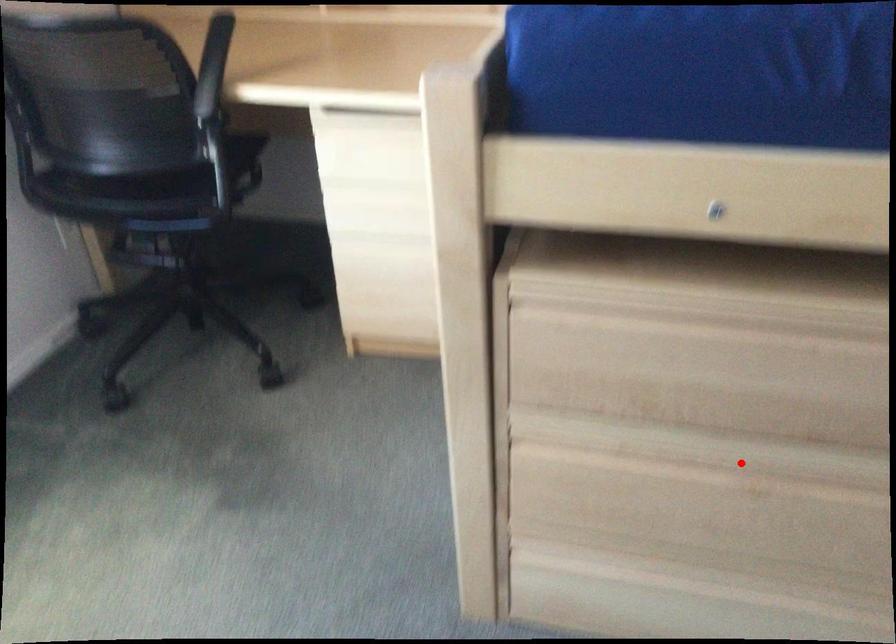
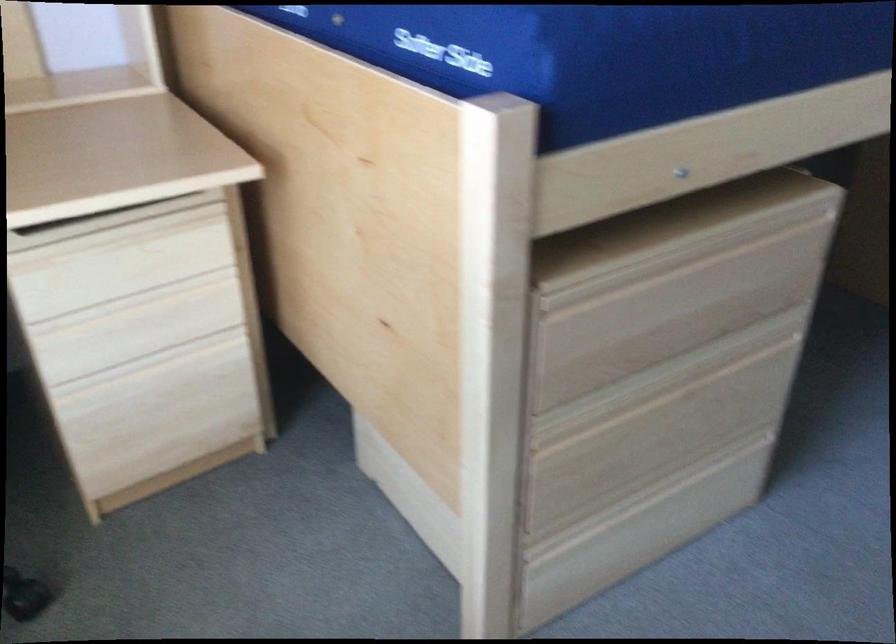
Question: I am providing you with two images of the same scene from different viewpoints. Given a red point in image1, look at the same physical point in image2. Is it:

Choices:
 (A) Closer to the viewpoint
 (B) Farther from the viewpoint

Answer: (B)